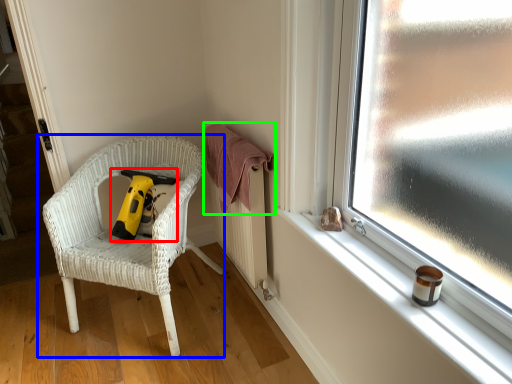
Question: Based on their relative distances, which object is nearer to vacuum (highlighted by a red box)? Choose from chair (highlighted by a blue box) and clothe (highlighted by a green box).

Choices:
 (A) chair
 (B) clothe

Answer: (A)